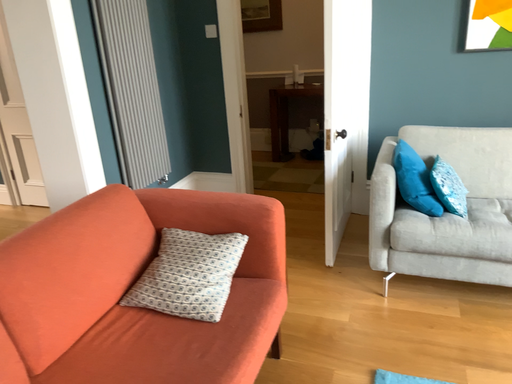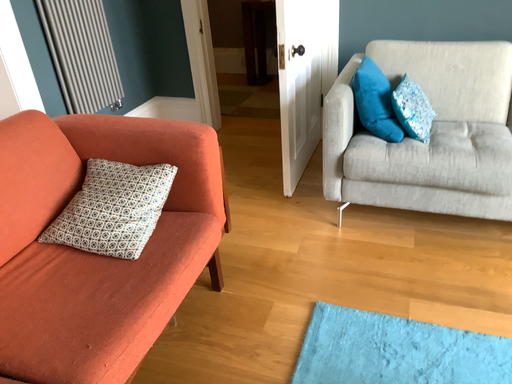
Question: Which way did the camera rotate in the video?

Choices:
 (A) rotated downward
 (B) rotated upward

Answer: (A)